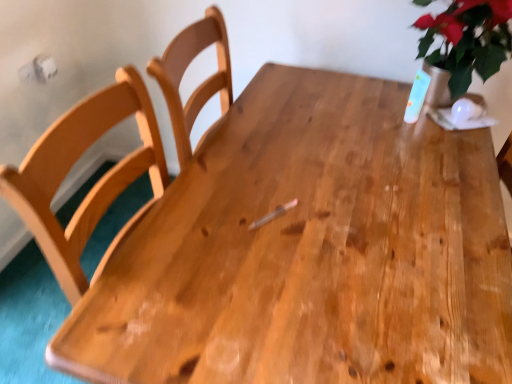
Where is `green leafy plant at upper right`? The image size is (512, 384). green leafy plant at upper right is located at coordinates (468, 40).

What do you see at coordinates (468, 40) in the screenshot?
I see `green leafy plant at upper right` at bounding box center [468, 40].

The height and width of the screenshot is (384, 512). I want to click on green leafy plant at upper right, so click(x=468, y=40).